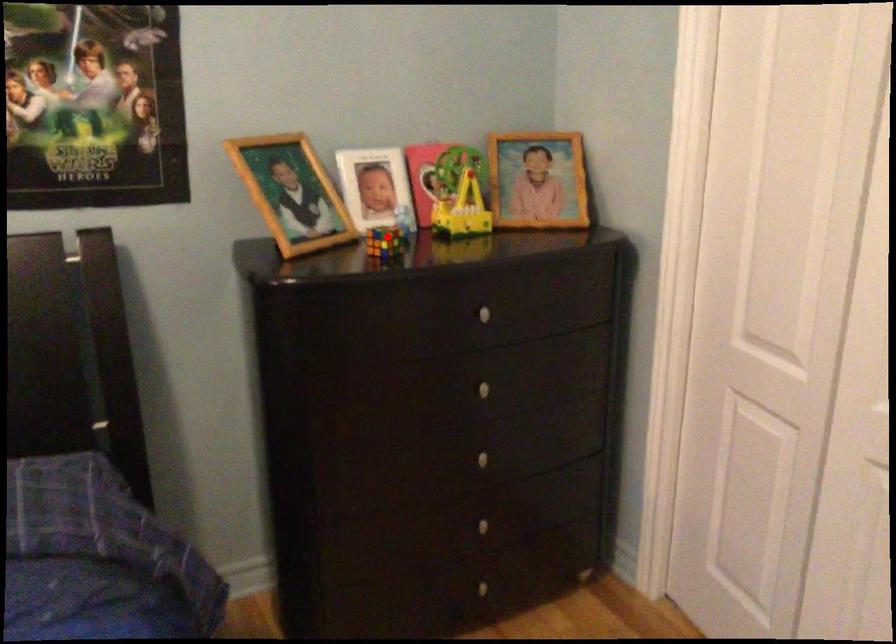
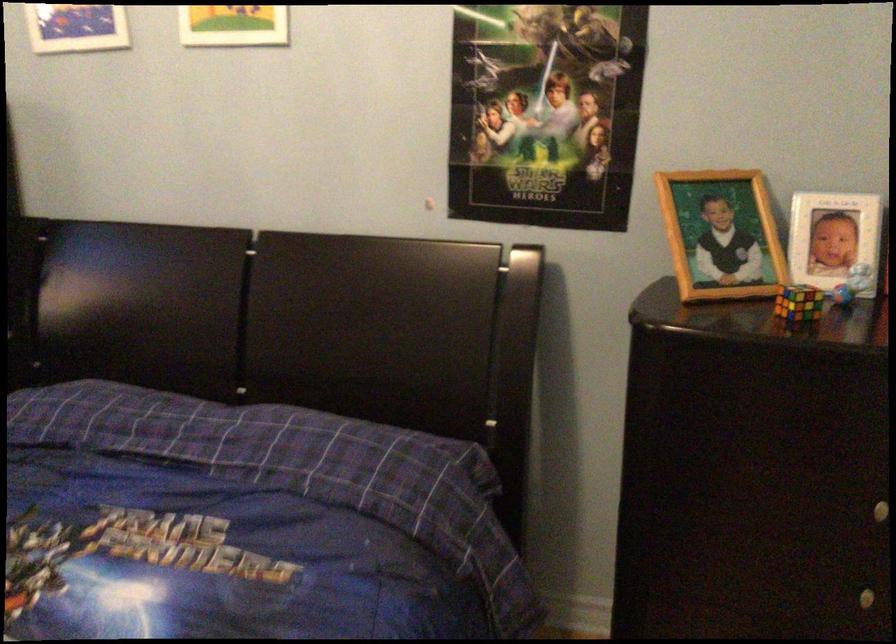
Question: I am providing you with two images of the same scene from different viewpoints. A red point is shown in image1. For the corresponding object point in image2, is it positioned nearer or farther from the camera?

Choices:
 (A) Nearer
 (B) Farther

Answer: (A)